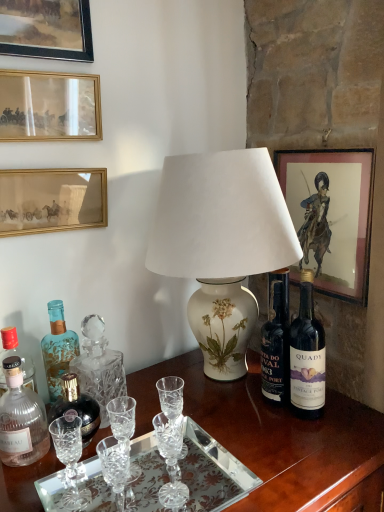
Find the location of `vacant area that lies between dark glass bottle at right and blue glass bottle at left, the third bottle viewed from the front`. vacant area that lies between dark glass bottle at right and blue glass bottle at left, the third bottle viewed from the front is located at coordinates (198, 415).